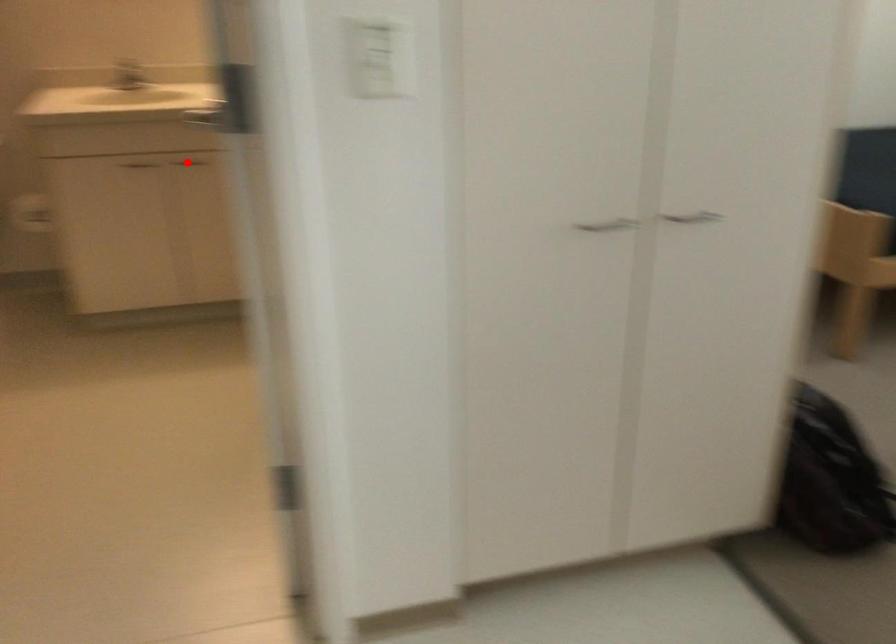
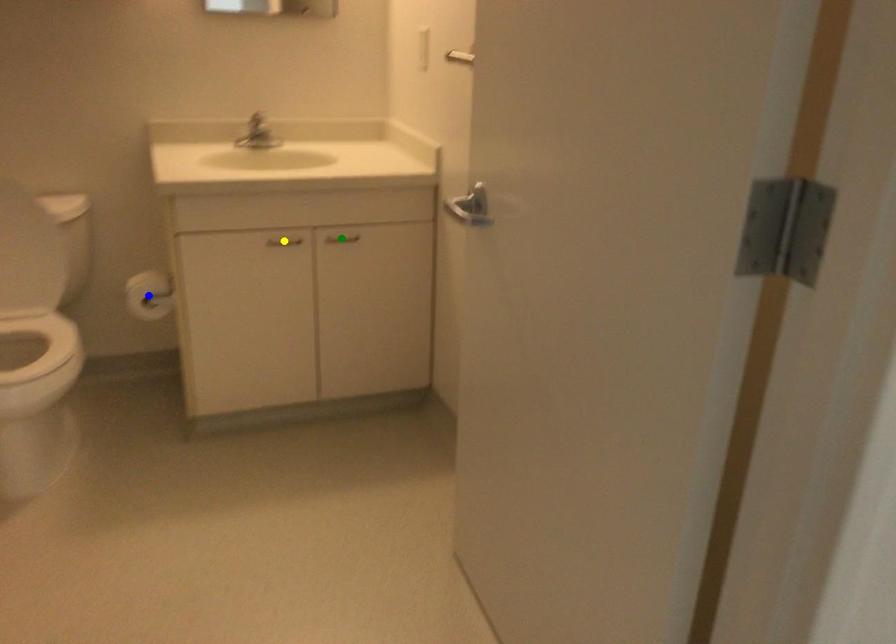
Question: I am providing you with two images of the same scene from different viewpoints. A red point is marked on the first image. You are given multiple points on the second image. Which mark in image 2 goes with the point in image 1?

Choices:
 (A) blue point
 (B) green point
 (C) yellow point

Answer: (B)